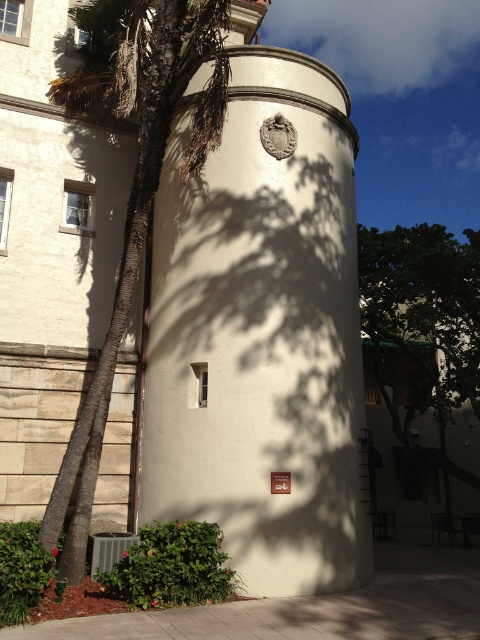
You are standing in front of a building complex and notice a white smooth bell tower at center and a green leafy tree at center. Which object is closer to you?

The white smooth bell tower at center is in front of the green leafy tree at center, so it is closer to you.

You are standing in front of the cylindrical structure and want to walk towards the green leafy tree at center. Which direction should you turn to avoid the green leafy palm tree at left?

You should turn to the right to avoid the green leafy palm tree at left, as it is located to the left of the green leafy tree at center.